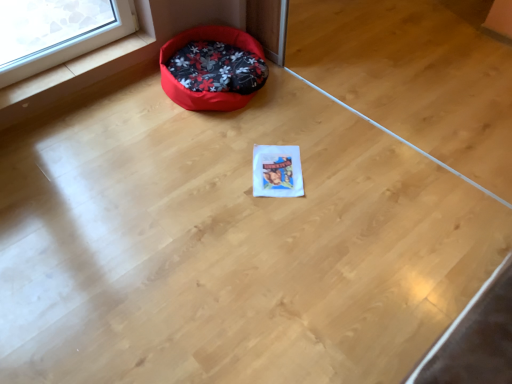
Find the location of `vacant area in front of floral fabric dog bed at upper left`. vacant area in front of floral fabric dog bed at upper left is located at coordinates (203, 146).